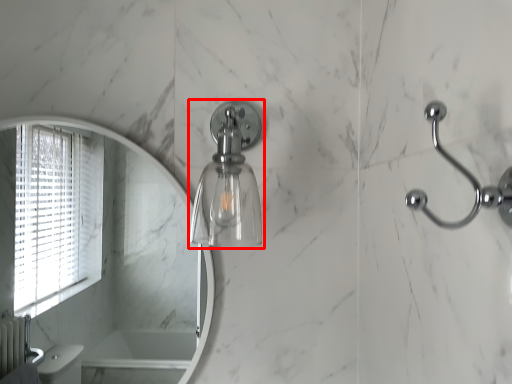
Question: Observing the image, what is the correct spatial positioning of soap dispenser (annotated by the red box) in reference to door handle?

Choices:
 (A) left
 (B) right

Answer: (A)